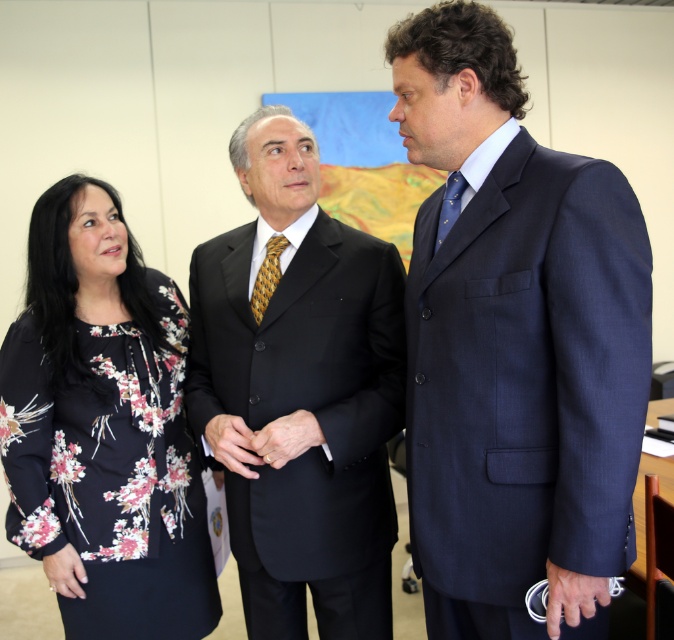
Is point (270, 410) positioned in front of point (275, 280)?

That is True.

The width and height of the screenshot is (674, 640). What do you see at coordinates (301, 394) in the screenshot?
I see `matte black suit at center` at bounding box center [301, 394].

I want to click on matte black suit at center, so click(x=301, y=394).

Is floral-patterned fabric dress at left below blue silk tie at right?

Yes.

Which is in front, point (73, 340) or point (454, 177)?

Point (454, 177) is more forward.

Identify the location of floral-patterned fabric dress at left. (102, 428).

Who is positioned more to the right, matte black suit at center or blue silk tie at right?

blue silk tie at right

Between matte black suit at center and blue silk tie at right, which one is positioned higher?

Positioned higher is blue silk tie at right.

Is point (350, 545) behind point (460, 182)?

That is True.

Locate an element on the screen. Image resolution: width=674 pixels, height=640 pixels. matte black suit at center is located at coordinates (301, 394).